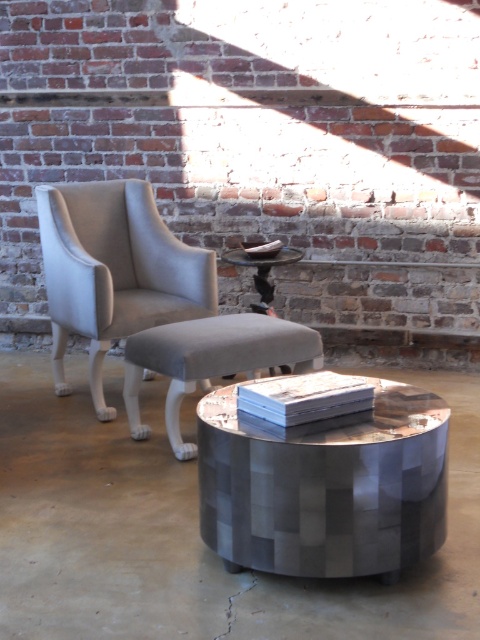
You are planning to rearrange the furniture in the living room. If you want to move the light gray fabric armchair at center closer to the entrance, which is on the right side of the room, will the metallic mosaic table at center block your path? Please explain your reasoning based on their sizes.

The metallic mosaic table at center occupies less space than the light gray fabric armchair at center. Since the table is smaller in size, it is less likely to block the path when moving the armchair towards the entrance on the right side of the room.

You are a delivery person trying to place a large package that is 30 inches long between the metallic mosaic table at center and the matte gray stool at center. Can the package fit in the space between them?

The distance between the metallic mosaic table at center and the matte gray stool at center is 29.89 inches, which is slightly shorter than the 30 inches length of the package. Therefore, the package cannot fit in the space between them.